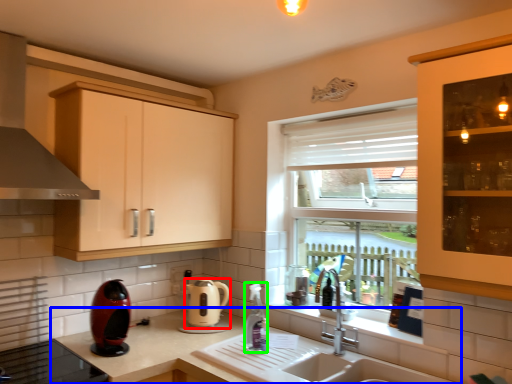
Question: Considering the real-world distances, which object is closest to kitchen appliance (highlighted by a red box)? countertop (highlighted by a blue box) or bottle (highlighted by a green box).

Choices:
 (A) countertop
 (B) bottle

Answer: (A)